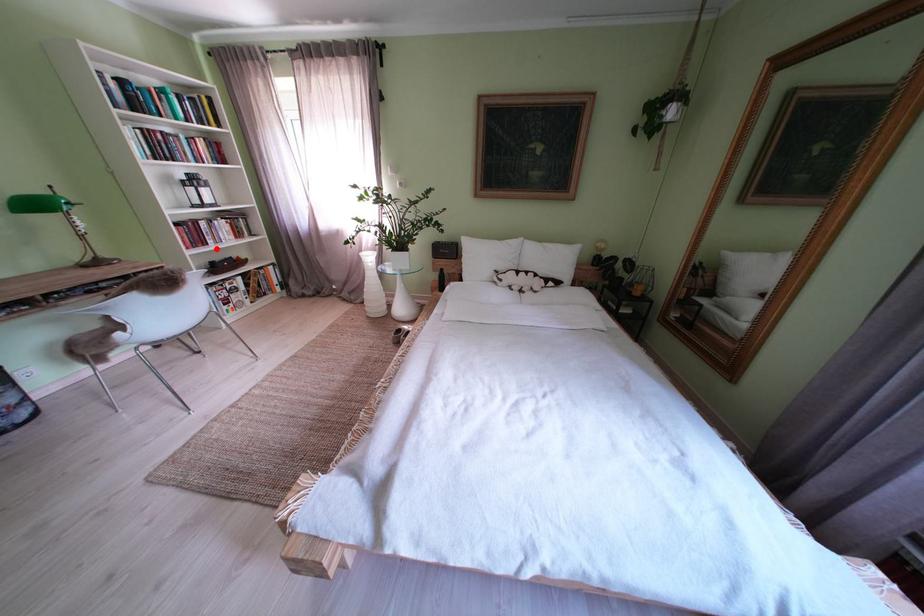
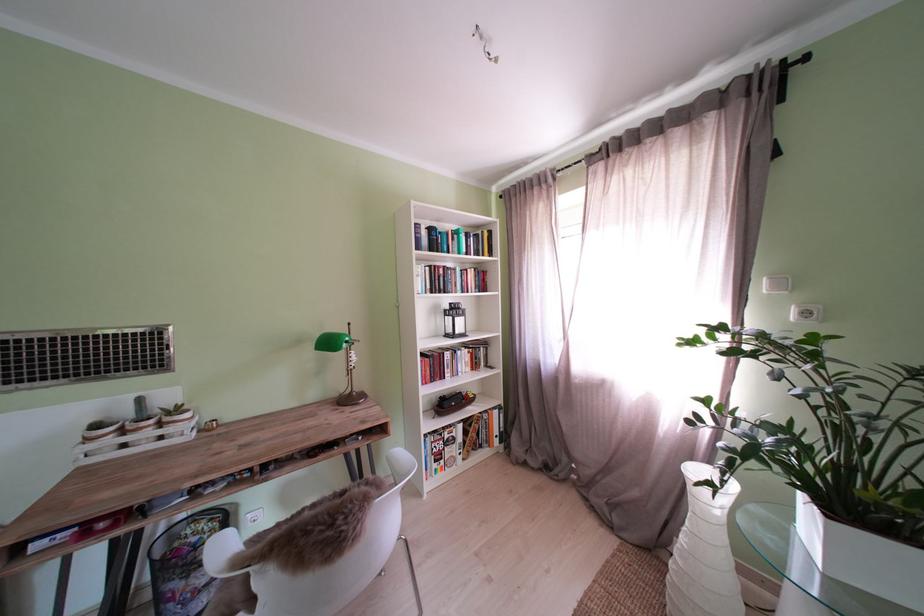
The point at the highlighted location is marked in the first image. Where is the corresponding point in the second image?

(454, 382)